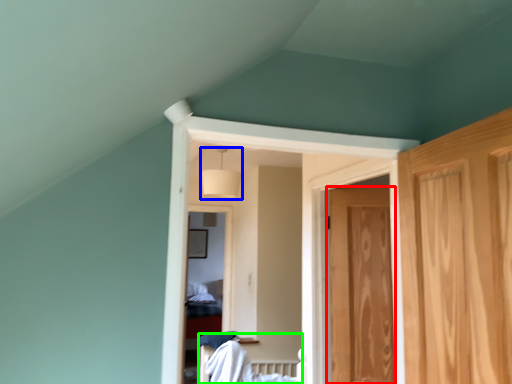
Question: Estimate the real-world distances between objects in this image. Which object is farther from door (highlighted by a red box), lamp (highlighted by a blue box) or bed (highlighted by a green box)?

Choices:
 (A) lamp
 (B) bed

Answer: (A)